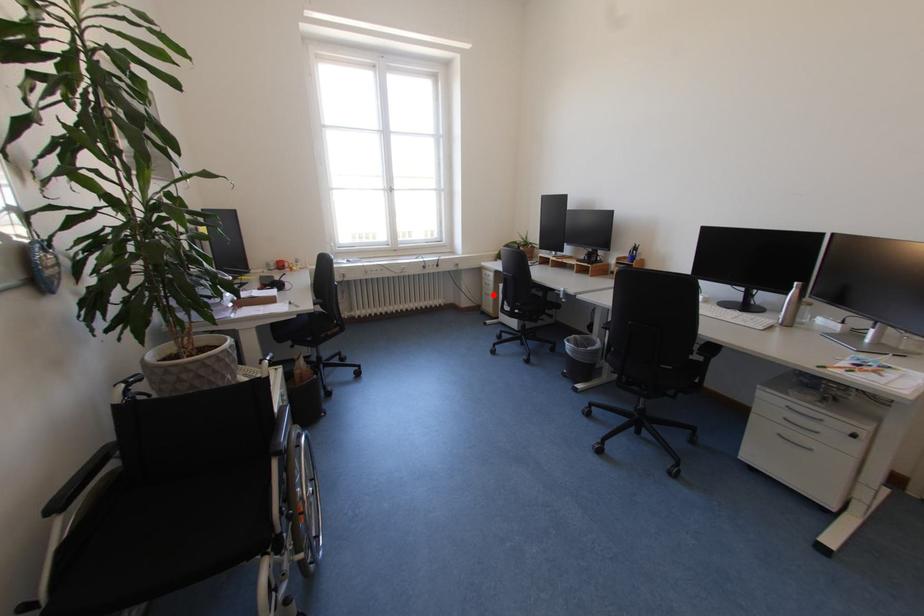
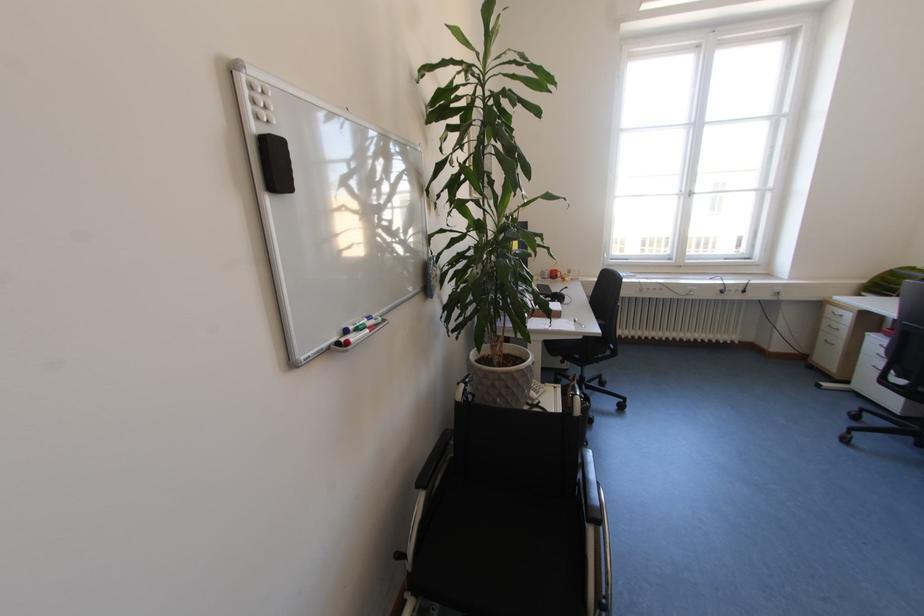
Question: I am providing you with two images of the same scene from different viewpoints. In image1, a red point is highlighted. Considering the same 3D point in image2, which of the following is correct?

Choices:
 (A) It is closer
 (B) It is farther

Answer: (B)